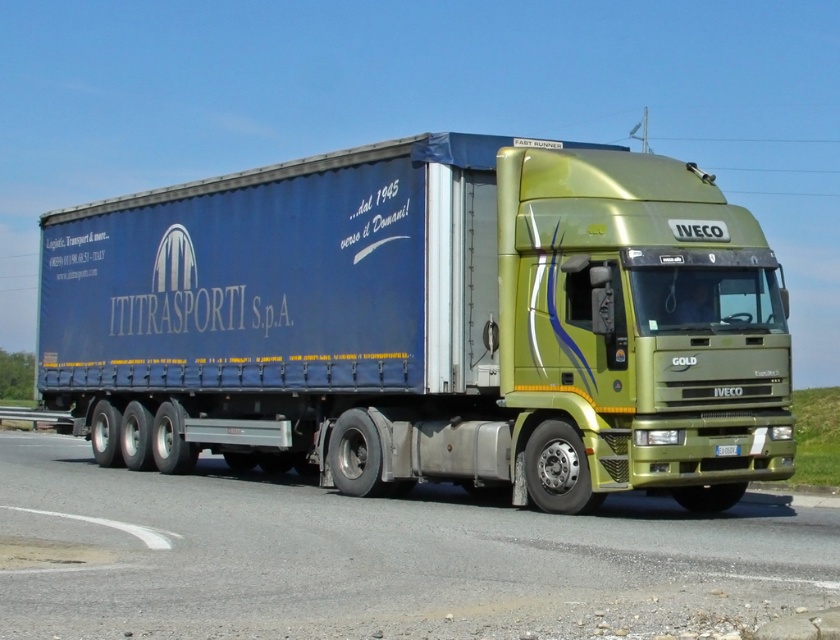
You are a driver approaching the metallic gold truck at center on the green metallic highway at center. Which object will you see first as you drive towards them?

You will see the metallic gold truck at center first because it is in front of the green metallic highway at center, so it will come into view before the highway.

You are a photographer planning to capture the metallic gold truck at center and the green metallic highway at center in a single shot. Considering their sizes, which object will occupy more space in the photo?

The metallic gold truck at center has a larger size compared to the green metallic highway at center, so it will occupy more space in the photo.